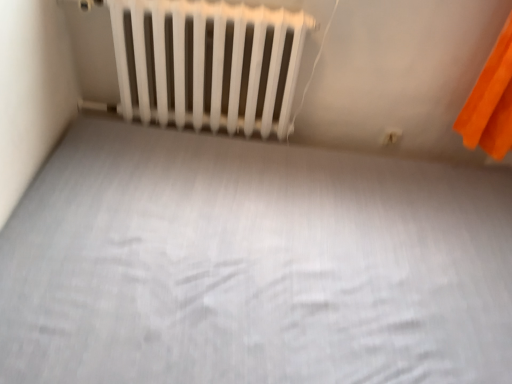
Where is `white matte radiator at upper center`? white matte radiator at upper center is located at coordinates (208, 63).

How many degrees apart are the facing directions of white plastic electric outlet at upper right and white matte bed frame at center?

There is a 2.64-degree angle between the facing directions of white plastic electric outlet at upper right and white matte bed frame at center.

Considering the relative positions of white plastic electric outlet at upper right and white matte bed frame at center in the image provided, is white plastic electric outlet at upper right behind white matte bed frame at center?

Yes, white plastic electric outlet at upper right is behind white matte bed frame at center.

From a real-world perspective, which is physically below, white plastic electric outlet at upper right or white matte bed frame at center?

white matte bed frame at center.

Which of these two, white plastic electric outlet at upper right or white matte bed frame at center, is wider?

With larger width is white matte bed frame at center.

Can white matte radiator at upper center be found inside white matte bed frame at center?

That's incorrect, white matte radiator at upper center is not inside white matte bed frame at center.

Considering the relative positions of white matte bed frame at center and white matte radiator at upper center in the image provided, is white matte bed frame at center to the right of white matte radiator at upper center from the viewer's perspective?

Indeed, white matte bed frame at center is positioned on the right side of white matte radiator at upper center.

Is white matte bed frame at center far away from white matte radiator at upper center?

No, white matte bed frame at center is not far from white matte radiator at upper center.

Who is taller, white matte bed frame at center or white matte radiator at upper center?

white matte radiator at upper center is taller.

Does white matte radiator at upper center have a greater height compared to white matte bed frame at center?

Yes.

Between white matte radiator at upper center and white matte bed frame at center, which one has smaller width?

Thinner between the two is white matte radiator at upper center.

From the image's perspective, does white matte radiator at upper center appear higher than white matte bed frame at center?

A: Indeed, from the image's perspective, white matte radiator at upper center is shown above white matte bed frame at center.

In terms of height, does white plastic electric outlet at upper right look taller or shorter compared to white matte radiator at upper center?

white plastic electric outlet at upper right is shorter than white matte radiator at upper center.

Consider the image. Which of these two, white plastic electric outlet at upper right or white matte radiator at upper center, is bigger?

With larger size is white matte radiator at upper center.

Based on the photo, measure the distance between white plastic electric outlet at upper right and white matte radiator at upper center.

white plastic electric outlet at upper right and white matte radiator at upper center are 36.73 inches apart from each other.

Is there a large distance between white plastic electric outlet at upper right and white matte radiator at upper center?

That's not correct — white plastic electric outlet at upper right is a little close to white matte radiator at upper center.

Is white plastic electric outlet at upper right at the back of white matte bed frame at center?

Correct, white matte bed frame at center is looking away from white plastic electric outlet at upper right.

In terms of width, does white matte bed frame at center look wider or thinner when compared to white plastic electric outlet at upper right?

Considering their sizes, white matte bed frame at center looks broader than white plastic electric outlet at upper right.

From a real-world perspective, is white matte bed frame at center located higher than white plastic electric outlet at upper right?

No, from a real-world perspective, white matte bed frame at center is not on top of white plastic electric outlet at upper right.

Is white plastic electric outlet at upper right a part of white matte bed frame at center?

No, white plastic electric outlet at upper right is not inside white matte bed frame at center.

From the image's perspective, is white matte radiator at upper center over white plastic electric outlet at upper right?

Yes.

Is white matte radiator at upper center further to the viewer compared to white plastic electric outlet at upper right?

No, white matte radiator at upper center is closer to the viewer.

Measure the distance between white matte radiator at upper center and white plastic electric outlet at upper right.

The distance of white matte radiator at upper center from white plastic electric outlet at upper right is 36.73 inches.

How many degrees apart are the facing directions of white matte radiator at upper center and white plastic electric outlet at upper right?

white matte radiator at upper center and white plastic electric outlet at upper right are facing 1.53 degrees away from each other.

I want to click on electric outlet above the white matte bed frame at center (from a real-world perspective), so click(x=391, y=136).

The height and width of the screenshot is (384, 512). Identify the location of radiator on the left of white matte bed frame at center. (208, 63).

From the image, which object appears to be nearer to white matte radiator at upper center, white plastic electric outlet at upper right or white matte bed frame at center?

Based on the image, white matte bed frame at center appears to be nearer to white matte radiator at upper center.

Which object lies nearer to the anchor point white plastic electric outlet at upper right, white matte bed frame at center or white matte radiator at upper center?

white matte radiator at upper center is closer to white plastic electric outlet at upper right.

From the image, which object appears to be nearer to white plastic electric outlet at upper right, white matte radiator at upper center or white matte bed frame at center?

Based on the image, white matte radiator at upper center appears to be nearer to white plastic electric outlet at upper right.

When comparing their distances from white matte bed frame at center, does white matte radiator at upper center or white plastic electric outlet at upper right seem closer?

white matte radiator at upper center is positioned closer to the anchor white matte bed frame at center.

Based on their spatial positions, is white matte bed frame at center or white plastic electric outlet at upper right further from white matte radiator at upper center?

The object further to white matte radiator at upper center is white plastic electric outlet at upper right.

Considering their positions, is white plastic electric outlet at upper right positioned further to white matte bed frame at center than white matte radiator at upper center?

white plastic electric outlet at upper right.

You are a GUI agent. You are given a task and a screenshot of the screen. Output one action in this format:
    pyautogui.click(x=<x>, y=<y>)
    Task: Click on the radiator positioned between white matte bed frame at center and white plastic electric outlet at upper right from near to far
    This screenshot has width=512, height=384.
    Given the screenshot: What is the action you would take?
    [x=208, y=63]